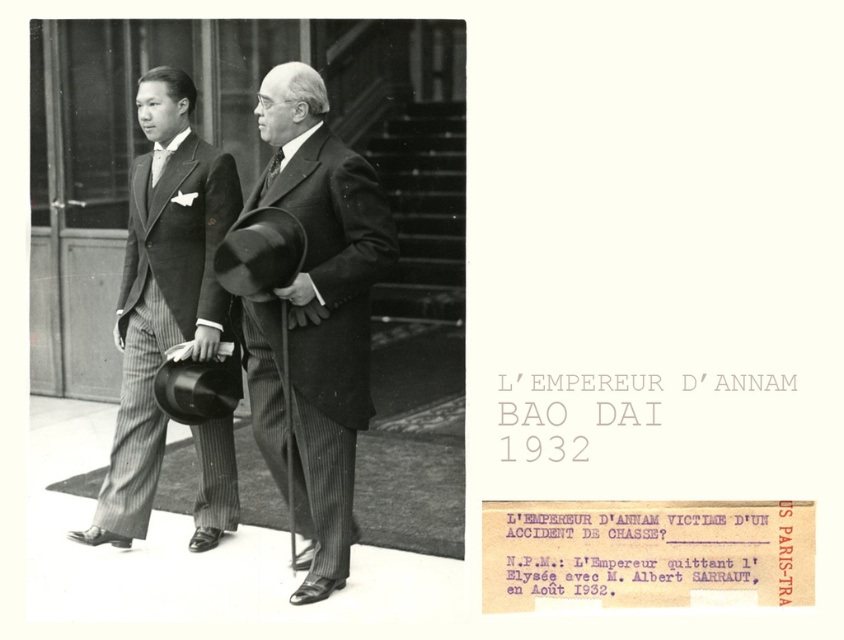
Question: Can you confirm if matte black suit at center is positioned to the right of matte black tie at left?

Choices:
 (A) no
 (B) yes

Answer: (B)

Question: Can you confirm if matte black suit at center is wider than matte black tie at center?

Choices:
 (A) yes
 (B) no

Answer: (A)

Question: Which of the following is the farthest from the observer?

Choices:
 (A) (196, 182)
 (B) (155, 145)

Answer: (B)

Question: Does matte black suit at center appear under matte black tie at left?

Choices:
 (A) no
 (B) yes

Answer: (B)

Question: Which object is positioned closest to the matte black tie at left?

Choices:
 (A) matte black tie at center
 (B) matte black suit at left

Answer: (B)

Question: Among these points, which one is nearest to the camera?

Choices:
 (A) (172, 131)
 (B) (312, 102)
 (C) (152, 186)

Answer: (B)